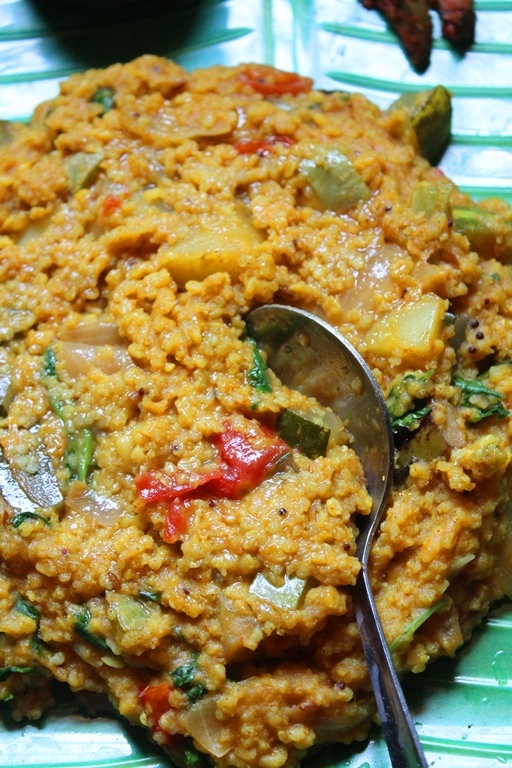
Find the location of a particular element. The height and width of the screenshot is (768, 512). table is located at coordinates (341, 48).